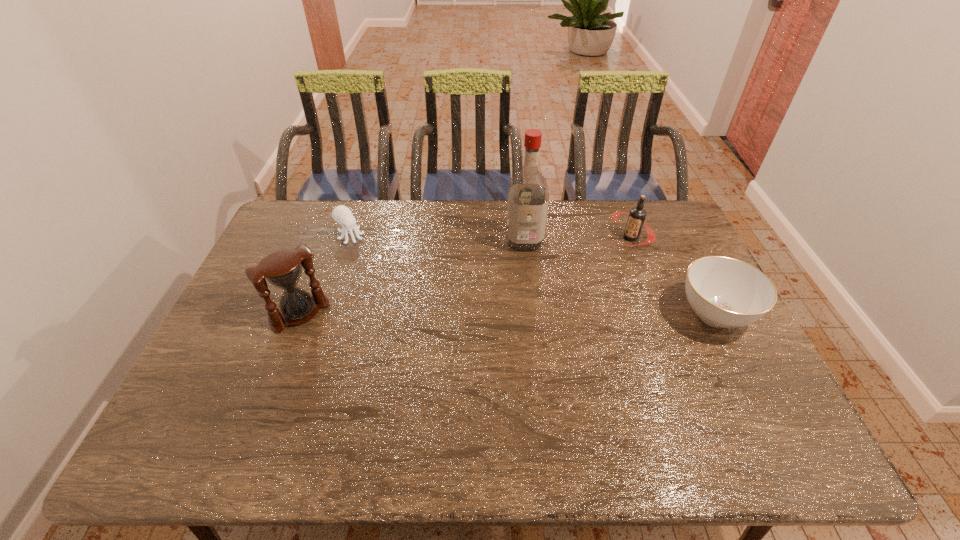
Identify the location of free space on the desktop that is between the second tallest object and the chinaware and is positioned on the label of the root beer. The width and height of the screenshot is (960, 540). (520, 314).

Where is `free space on the desktop that is between the hourglass and the chinaware and is positioned on the front-facing side of the third object from left to right`? The image size is (960, 540). free space on the desktop that is between the hourglass and the chinaware and is positioned on the front-facing side of the third object from left to right is located at coordinates [x=534, y=314].

This screenshot has height=540, width=960. Identify the location of free space on the desktop that is between the second tallest object and the chinaware and is positioned on the front-facing side of the octopus. (460, 313).